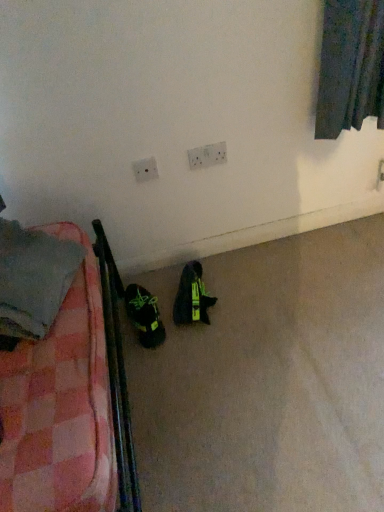
Question: Visually, is white plastic electric outlet at upper center, the first electric outlet from the right, positioned to the left or to the right of plaid fabric blanket at left?

Choices:
 (A) left
 (B) right

Answer: (B)

Question: Considering the positions of white plastic electric outlet at upper center, the first electric outlet from the right, and plaid fabric blanket at left in the image, is white plastic electric outlet at upper center, the first electric outlet from the right, taller or shorter than plaid fabric blanket at left?

Choices:
 (A) short
 (B) tall

Answer: (A)

Question: Which object is positioned farthest from the white plastic electric outlet at upper center, the first electric outlet from the right?

Choices:
 (A) plaid fabric blanket at left
 (B) white plastic electric outlet at upper center, which is the second electric outlet in right-to-left order
 (C) green matte sneakers at lower left, arranged as the 2th footwear when viewed from the right
 (D) green synthetic shoe at center, which appears as the second footwear when viewed from the left

Answer: (A)

Question: Based on their relative distances, which object is nearer to the green synthetic shoe at center, which ranks as the first footwear in right-to-left order?

Choices:
 (A) plaid fabric blanket at left
 (B) white plastic electric outlet at upper center, the first electric outlet from the right
 (C) green matte sneakers at lower left, positioned as the first footwear in left-to-right order
 (D) white plastic electric outlet at upper center, which is the second electric outlet in right-to-left order

Answer: (C)